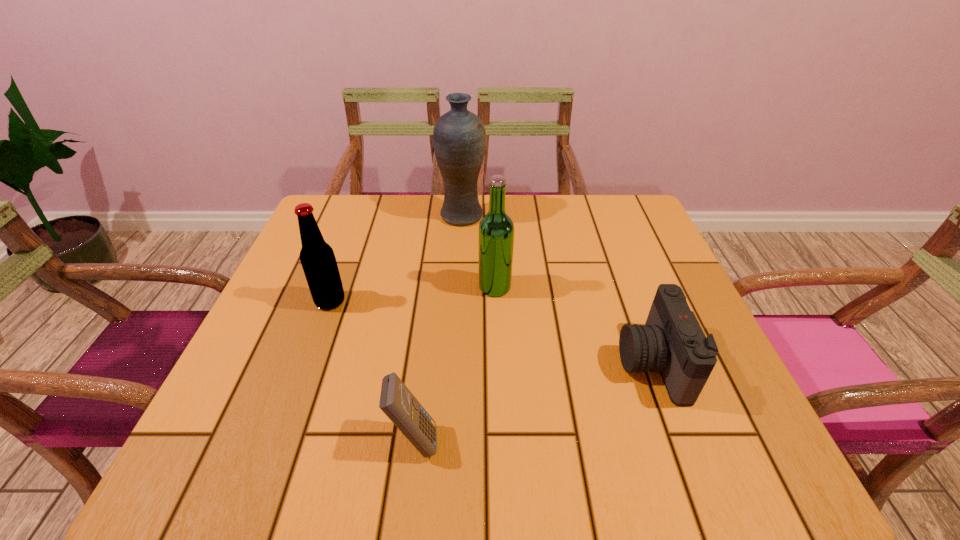
Locate an element on the screen. The width and height of the screenshot is (960, 540). the tallest object is located at coordinates (459, 138).

Where is `vase`? This screenshot has height=540, width=960. vase is located at coordinates (459, 138).

The image size is (960, 540). Find the location of `the right beer bottle`. the right beer bottle is located at coordinates (496, 229).

At what (x,y) coordinates should I click in order to perform the action: click on the leftmost object. Please return your answer as a coordinate pair (x, y). This screenshot has width=960, height=540. Looking at the image, I should click on (317, 258).

I want to click on calculator, so click(x=398, y=403).

What are the coordinates of `the rightmost object` in the screenshot? It's located at (672, 342).

Where is `the second nearest object`? the second nearest object is located at coordinates (672, 342).

Image resolution: width=960 pixels, height=540 pixels. What are the coordinates of `vacant space situated on the right of the vase` in the screenshot? It's located at (525, 216).

At what (x,y) coordinates should I click in order to perform the action: click on vacant area situated on the left of the right beer bottle. Please return your answer as a coordinate pair (x, y). The width and height of the screenshot is (960, 540). Looking at the image, I should click on (435, 287).

This screenshot has width=960, height=540. In order to click on vacant space located 0.150m on the front of the left beer bottle in this screenshot , I will do `click(305, 369)`.